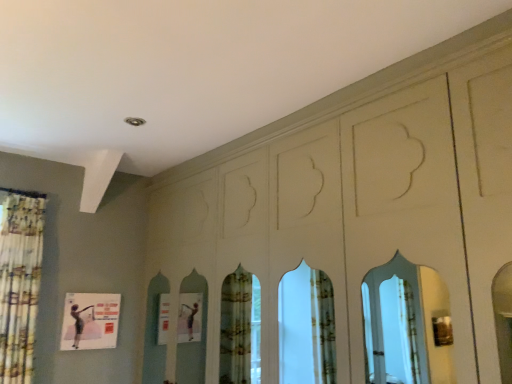
Question: Is floral fabric shower curtain at left bigger than matte pink poster at lower left?

Choices:
 (A) no
 (B) yes

Answer: (B)

Question: Is floral fabric shower curtain at left placed right next to matte pink poster at lower left?

Choices:
 (A) no
 (B) yes

Answer: (A)

Question: Does floral fabric shower curtain at left have a greater height compared to matte pink poster at lower left?

Choices:
 (A) yes
 (B) no

Answer: (A)

Question: From a real-world perspective, is floral fabric shower curtain at left positioned over matte pink poster at lower left based on gravity?

Choices:
 (A) yes
 (B) no

Answer: (A)

Question: From a real-world perspective, does floral fabric shower curtain at left sit lower than matte pink poster at lower left?

Choices:
 (A) no
 (B) yes

Answer: (A)

Question: Can you confirm if floral fabric shower curtain at left is positioned to the left of matte pink poster at lower left?

Choices:
 (A) no
 (B) yes

Answer: (B)

Question: From a real-world perspective, is matte pink poster at lower left positioned under floral fabric shower curtain at left based on gravity?

Choices:
 (A) yes
 (B) no

Answer: (A)

Question: From the image's perspective, is matte pink poster at lower left below floral fabric shower curtain at left?

Choices:
 (A) yes
 (B) no

Answer: (A)

Question: Considering the relative sizes of matte pink poster at lower left and floral fabric shower curtain at left in the image provided, is matte pink poster at lower left smaller than floral fabric shower curtain at left?

Choices:
 (A) no
 (B) yes

Answer: (B)

Question: Is matte pink poster at lower left at the right side of floral fabric shower curtain at left?

Choices:
 (A) yes
 (B) no

Answer: (A)

Question: Is matte pink poster at lower left touching floral fabric shower curtain at left?

Choices:
 (A) yes
 (B) no

Answer: (B)

Question: Is matte pink poster at lower left taller than floral fabric shower curtain at left?

Choices:
 (A) yes
 (B) no

Answer: (B)

Question: Which is correct: floral fabric shower curtain at left is inside matte pink poster at lower left, or outside of it?

Choices:
 (A) outside
 (B) inside

Answer: (A)